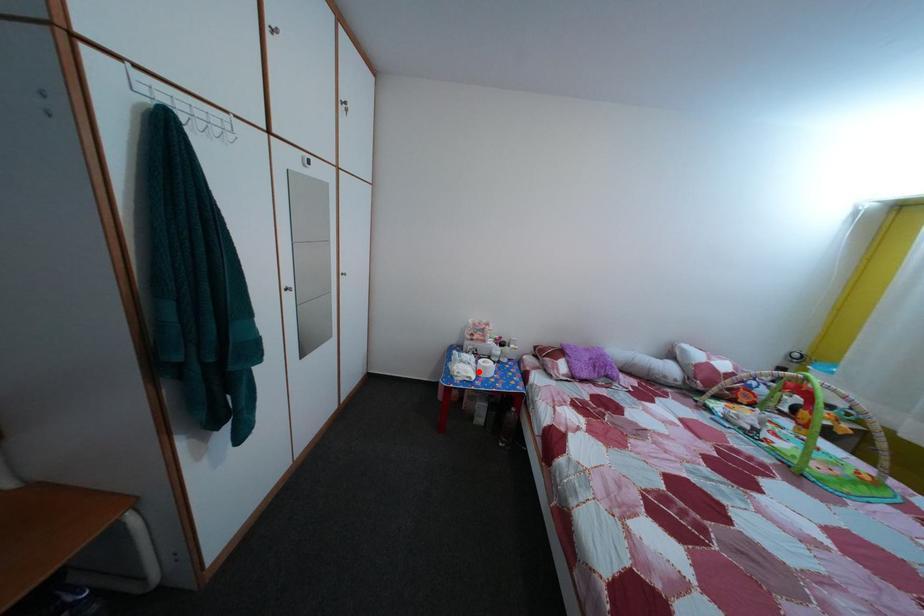
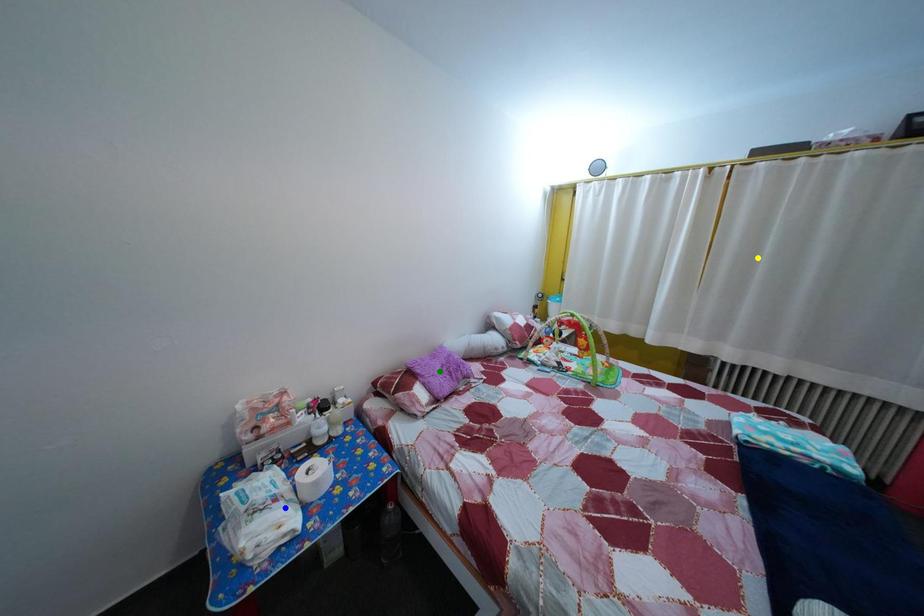
Question: I am providing you with two images of the same scene from different viewpoints. A red point is marked on the first image. You are given multiple points on the second image. Can you choose the point in image 2 that corresponds to the point in image 1?

Choices:
 (A) green point
 (B) blue point
 (C) yellow point

Answer: (B)